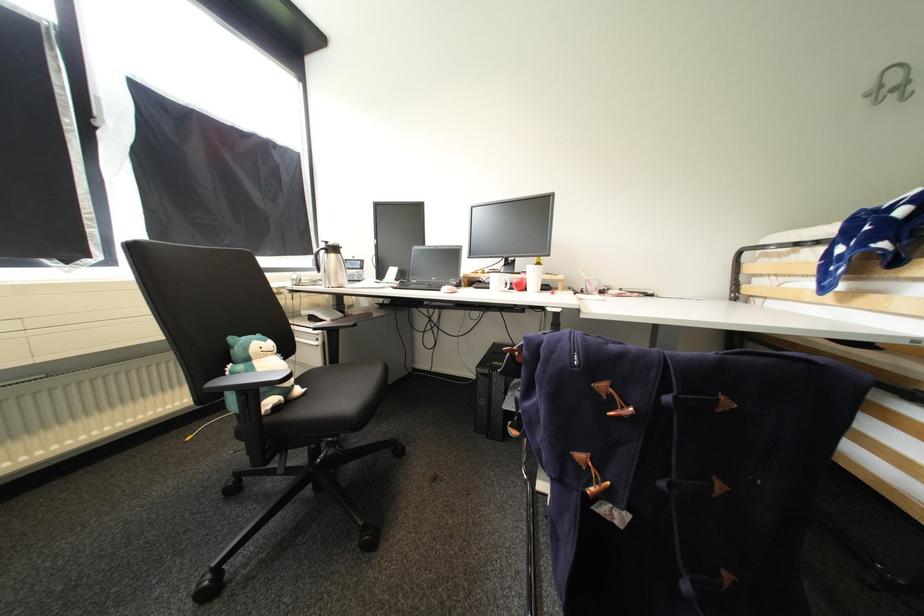
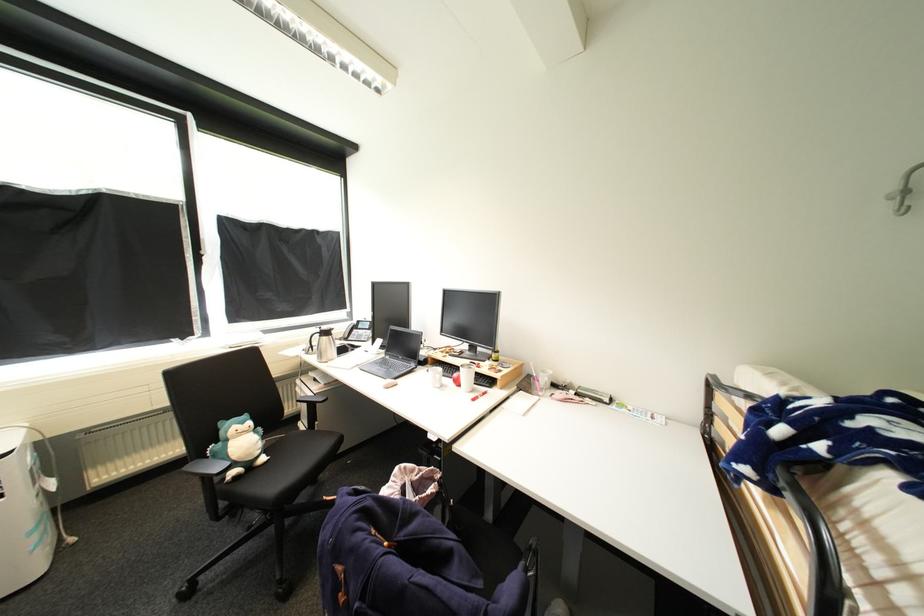
Where in the second image is the point corresponding to [356,270] from the first image?

(367, 330)